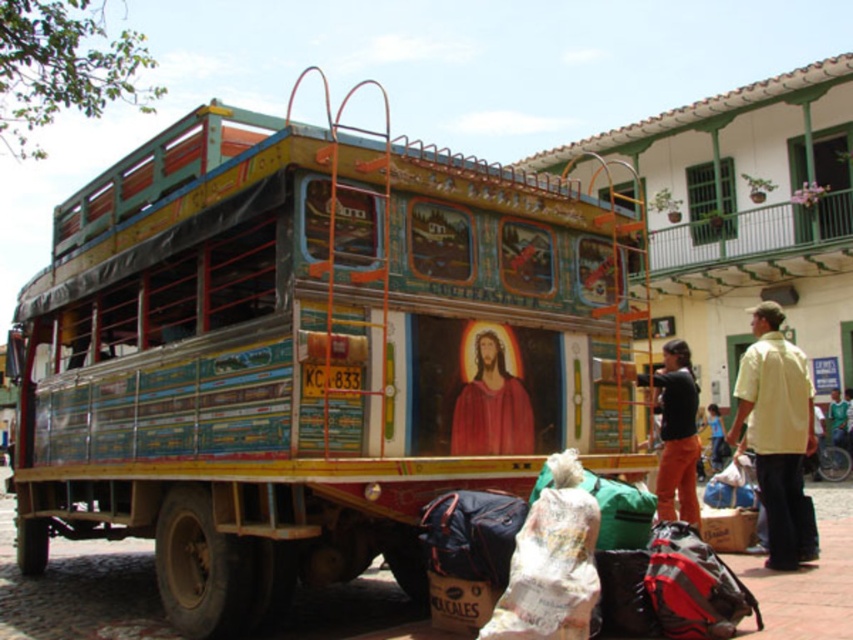
Question: Does yellow cotton shirt at right come behind orange pants at center?

Choices:
 (A) no
 (B) yes

Answer: (A)

Question: Which point appears closest to the camera in this image?

Choices:
 (A) (514, 390)
 (B) (305, 196)
 (C) (778, 403)
 (D) (660, 406)

Answer: (B)

Question: Which point appears farthest from the camera in this image?

Choices:
 (A) (670, 376)
 (B) (805, 433)
 (C) (625, 349)

Answer: (A)

Question: Which point is farther to the camera?

Choices:
 (A) yellow cotton shirt at right
 (B) orange pants at center
 (C) red painted figure at center

Answer: (B)

Question: Is painted wood food truck at center thinner than orange pants at center?

Choices:
 (A) no
 (B) yes

Answer: (A)

Question: Can you confirm if painted wood food truck at center is positioned above yellow cotton shirt at right?

Choices:
 (A) yes
 (B) no

Answer: (A)